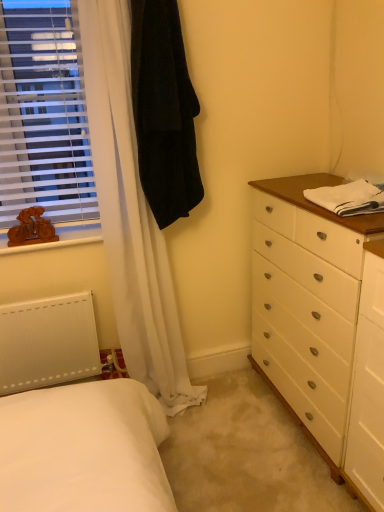
Question: Is point (183, 91) closer or farther from the camera than point (69, 111)?

Choices:
 (A) closer
 (B) farther

Answer: (A)

Question: From a real-world perspective, is black velvet robe at upper left positioned above or below white plastic blinds at left?

Choices:
 (A) below
 (B) above

Answer: (A)

Question: Which object is the closest to the white matte radiator at lower left?

Choices:
 (A) wooden figure at left
 (B) black velvet robe at upper left
 (C) white cotton towel at right
 (D) white plastic blinds at left

Answer: (A)

Question: Which object is positioned closest to the wooden figure at left?

Choices:
 (A) white plastic blinds at left
 (B) black velvet robe at upper left
 (C) white cotton towel at right
 (D) white matte radiator at lower left

Answer: (A)